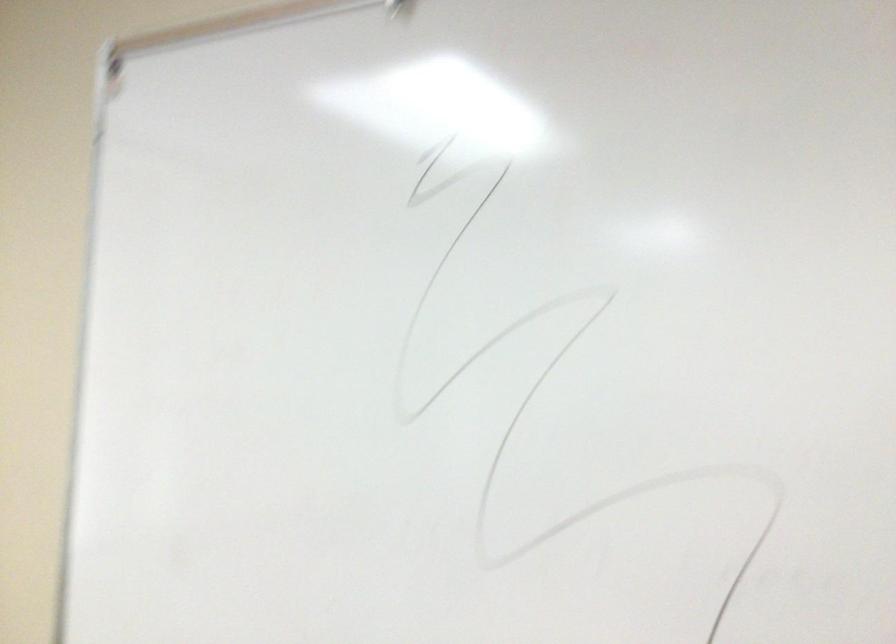
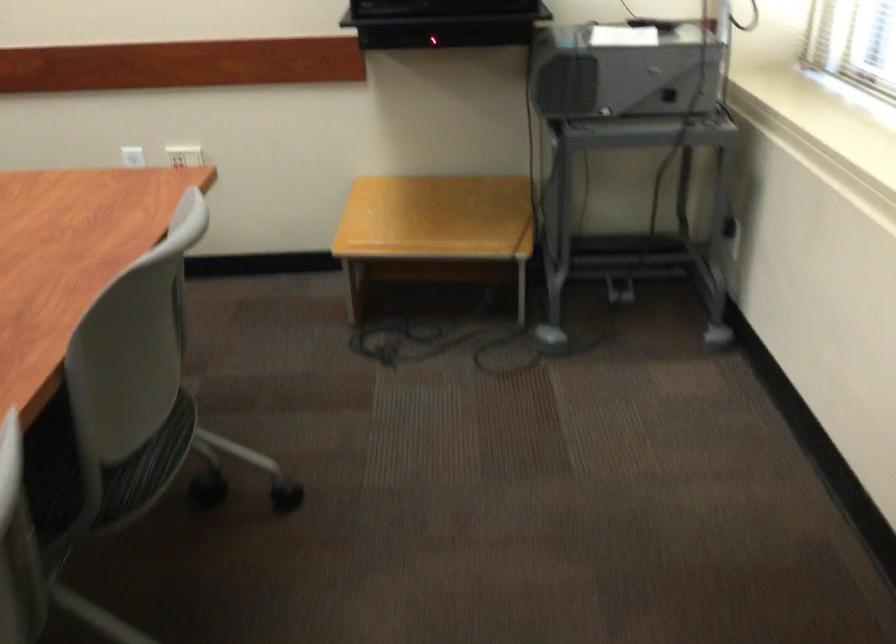
How did the camera likely rotate?

The camera's rotation is toward right-down.